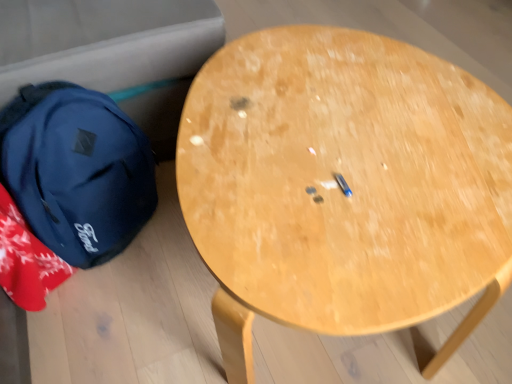
Question: From the image's perspective, would you say light wood table at center is positioned over matte blue backpack at left?

Choices:
 (A) no
 (B) yes

Answer: (A)

Question: Is light wood table at center completely or partially outside of matte blue backpack at left?

Choices:
 (A) yes
 (B) no

Answer: (A)

Question: Can you confirm if light wood table at center is bigger than matte blue backpack at left?

Choices:
 (A) yes
 (B) no

Answer: (A)

Question: Considering the relative sizes of light wood table at center and matte blue backpack at left in the image provided, is light wood table at center smaller than matte blue backpack at left?

Choices:
 (A) no
 (B) yes

Answer: (A)

Question: Is light wood table at center shorter than matte blue backpack at left?

Choices:
 (A) no
 (B) yes

Answer: (A)

Question: From the image's perspective, would you say light wood table at center is shown under matte blue backpack at left?

Choices:
 (A) yes
 (B) no

Answer: (A)

Question: Considering the relative positions of matte blue backpack at left and light wood table at center in the image provided, is matte blue backpack at left to the left of light wood table at center from the viewer's perspective?

Choices:
 (A) yes
 (B) no

Answer: (A)

Question: Would you say matte blue backpack at left is outside light wood table at center?

Choices:
 (A) yes
 (B) no

Answer: (A)

Question: Is the depth of matte blue backpack at left less than that of light wood table at center?

Choices:
 (A) no
 (B) yes

Answer: (A)

Question: Is matte blue backpack at left looking in the opposite direction of light wood table at center?

Choices:
 (A) no
 (B) yes

Answer: (A)

Question: Considering the relative sizes of matte blue backpack at left and light wood table at center in the image provided, is matte blue backpack at left shorter than light wood table at center?

Choices:
 (A) no
 (B) yes

Answer: (B)

Question: Considering the relative sizes of matte blue backpack at left and light wood table at center in the image provided, is matte blue backpack at left wider than light wood table at center?

Choices:
 (A) no
 (B) yes

Answer: (A)

Question: From the image's perspective, is matte blue backpack at left located above or below light wood table at center?

Choices:
 (A) above
 (B) below

Answer: (A)